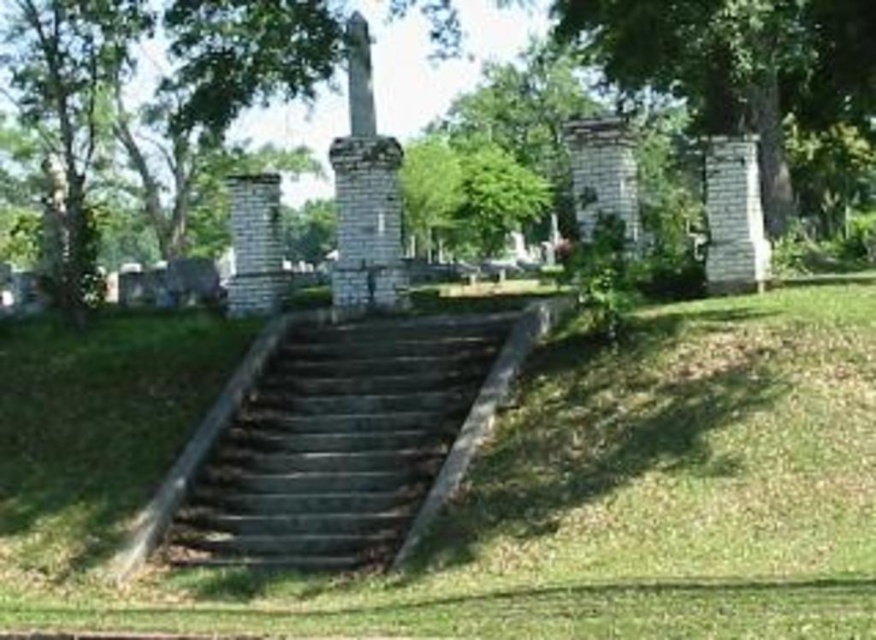
Between point (359, 509) and point (820, 13), which one is positioned in front?

Point (359, 509)

Can you confirm if dark gray stone stairs at center is positioned above green leafy tree at upper right?

Actually, dark gray stone stairs at center is below green leafy tree at upper right.

Find the location of a particular element. The width and height of the screenshot is (876, 640). dark gray stone stairs at center is located at coordinates (336, 442).

This screenshot has width=876, height=640. I want to click on dark gray stone stairs at center, so click(336, 442).